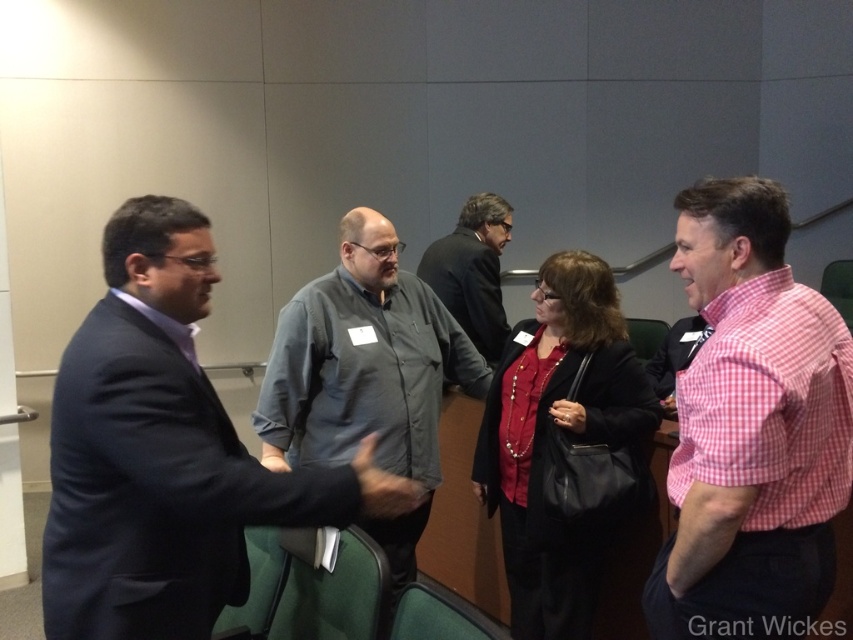
Which is behind, point (735, 614) or point (297, 340)?

Point (297, 340)

Does pink checkered shirt at right have a smaller size compared to gray matte shirt at center?

Yes.

Who is more distant from viewer, (738, 593) or (277, 320)?

The point (277, 320) is more distant.

In order to click on pink checkered shirt at right in this screenshot , I will do `click(752, 429)`.

Is gray matte shirt at center behind dark brown suit jacket at center?

No, it is in front of dark brown suit jacket at center.

Does gray matte shirt at center have a greater width compared to dark brown suit jacket at center?

Indeed, gray matte shirt at center has a greater width compared to dark brown suit jacket at center.

Is point (407, 308) behind point (438, 260)?

No, it is not.

Locate an element on the screen. gray matte shirt at center is located at coordinates (366, 376).

Does dark blue suit at left appear under gray matte shirt at center?

Yes.

Does dark blue suit at left lie in front of gray matte shirt at center?

That is True.

Describe the element at coordinates (166, 452) in the screenshot. I see `dark blue suit at left` at that location.

Identify the location of dark blue suit at left. 166,452.